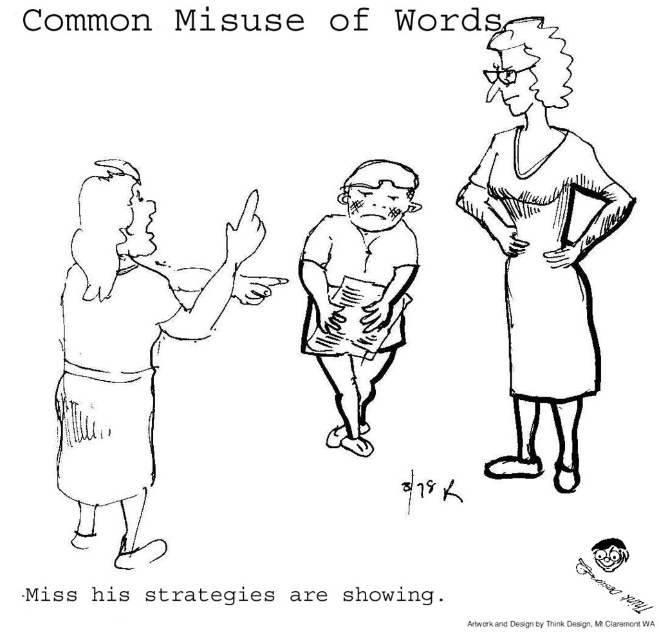
Question: Among these objects, which one is nearest to the camera?

Choices:
 (A) smooth skin man at left
 (B) fat man at center

Answer: (A)

Question: Does matte black dress at right have a larger size compared to smooth skin man at left?

Choices:
 (A) yes
 (B) no

Answer: (B)

Question: Can you confirm if matte black dress at right is bigger than smooth skin man at left?

Choices:
 (A) yes
 (B) no

Answer: (B)

Question: Which object is closer to the camera taking this photo?

Choices:
 (A) smooth skin man at left
 (B) matte black dress at right
 (C) fat man at center

Answer: (A)

Question: Based on their relative distances, which object is nearer to the matte black dress at right?

Choices:
 (A) smooth skin man at left
 (B) fat man at center

Answer: (B)

Question: Is matte black dress at right positioned at the back of smooth skin man at left?

Choices:
 (A) no
 (B) yes

Answer: (B)